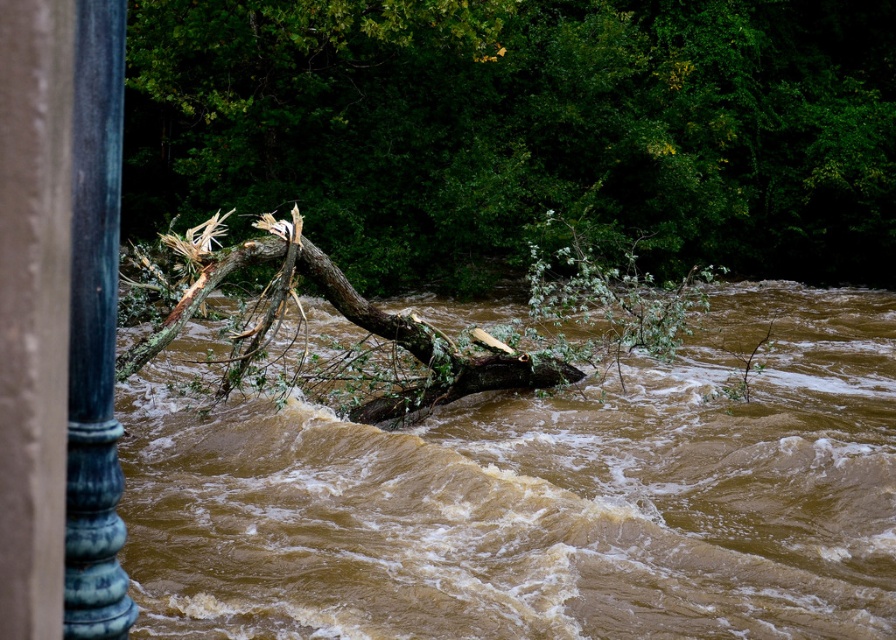
What are the coordinates of `brown wood tree at center` in the screenshot? It's located at (524, 131).

Consider the image. Is brown wood tree at center taller than blue polished metal pole at left?

Indeed, brown wood tree at center has a greater height compared to blue polished metal pole at left.

Locate an element on the screen. brown wood tree at center is located at coordinates coord(524,131).

Is brown muddy water at center closer to camera compared to blue polished metal pole at left?

No, it is behind blue polished metal pole at left.

Who is positioned more to the right, brown muddy water at center or blue polished metal pole at left?

brown muddy water at center is more to the right.

Is point (212, 481) more distant than point (117, 499)?

Yes.

Image resolution: width=896 pixels, height=640 pixels. What are the coordinates of `brown muddy water at center` in the screenshot? It's located at (538, 497).

Does brown muddy water at center have a smaller size compared to brown wood tree at center?

Indeed, brown muddy water at center has a smaller size compared to brown wood tree at center.

Looking at this image, who is more forward, (511,563) or (216,168)?

Point (511,563) is in front.

Locate an element on the screen. Image resolution: width=896 pixels, height=640 pixels. brown muddy water at center is located at coordinates coord(538,497).